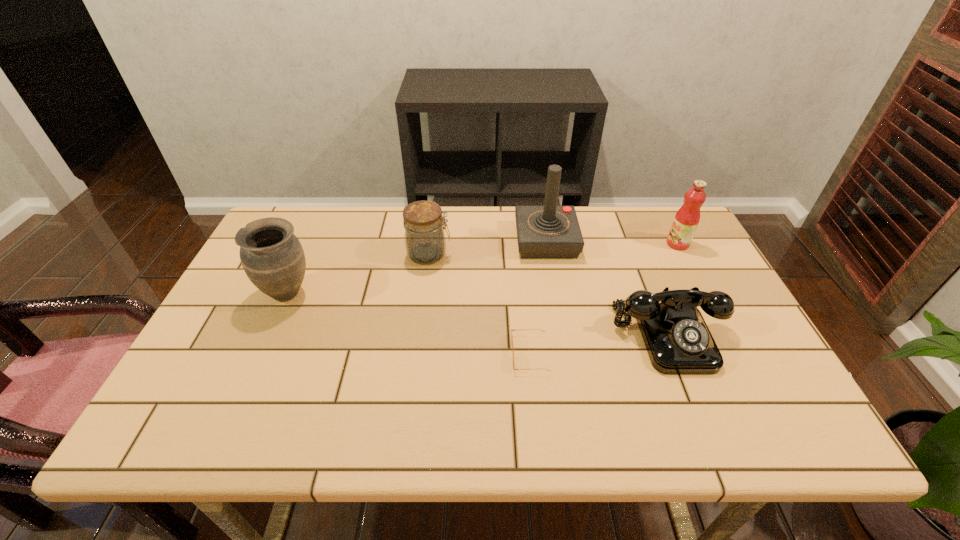
This screenshot has width=960, height=540. I want to click on the tallest object, so click(544, 232).

Locate an element on the screen. fruit juice is located at coordinates (686, 220).

Identify the location of the leftmost object. (271, 255).

Image resolution: width=960 pixels, height=540 pixels. What are the coordinates of `the third shortest object` in the screenshot? It's located at (425, 242).

Find the location of a particular element. The width and height of the screenshot is (960, 540). the second object from left to right is located at coordinates (425, 242).

This screenshot has height=540, width=960. Find the location of `telephone`. telephone is located at coordinates (678, 341).

You are a GUI agent. You are given a task and a screenshot of the screen. Output one action in this format:
    pyautogui.click(x=<x>, y=<y>)
    Task: Click on the sunglasses
    
    Given the screenshot: What is the action you would take?
    pyautogui.click(x=511, y=329)

The height and width of the screenshot is (540, 960). I want to click on vacant region located on the rectangular base of the joystick, so click(416, 241).

Identify the location of vacant space located on the rectangular base of the joystick. (477, 241).

Where is `vacant space located 0.350m on the rectangular base of the joystick`? vacant space located 0.350m on the rectangular base of the joystick is located at coordinates (402, 241).